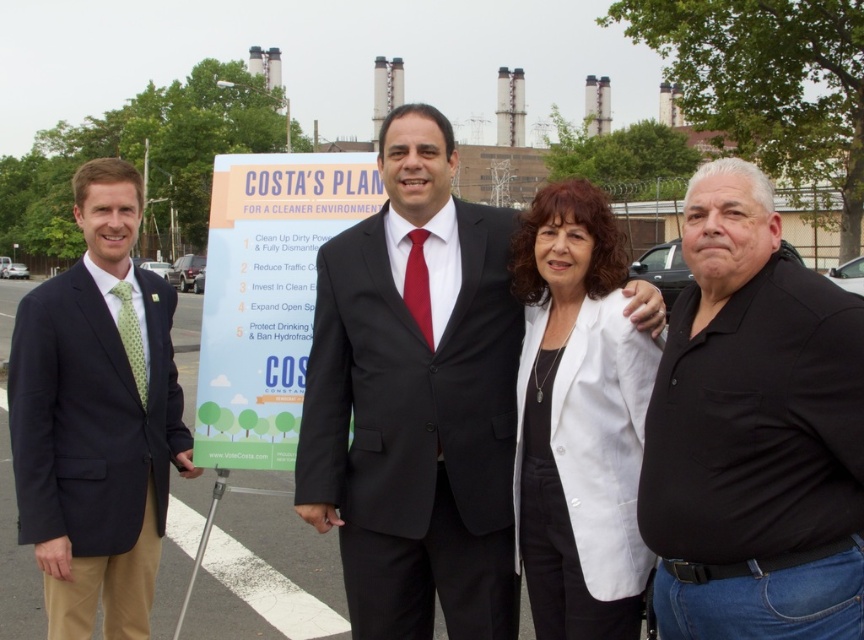
You are standing in front of the signboard and notice two points listed on it. The first point is at coordinate point (808, 481) and the second point is at coordinate point (264, 404). Which point do you think is closer to you?

The point at coordinate (808, 481) is closer to the viewer than the point at coordinate (264, 404).

You are a photographer standing at the origin point of the image coordinate system. You want to take a photo of the matte black suit at center. What are the coordinates where you should aim your camera?

The coordinates to aim the camera are at point (416,400).